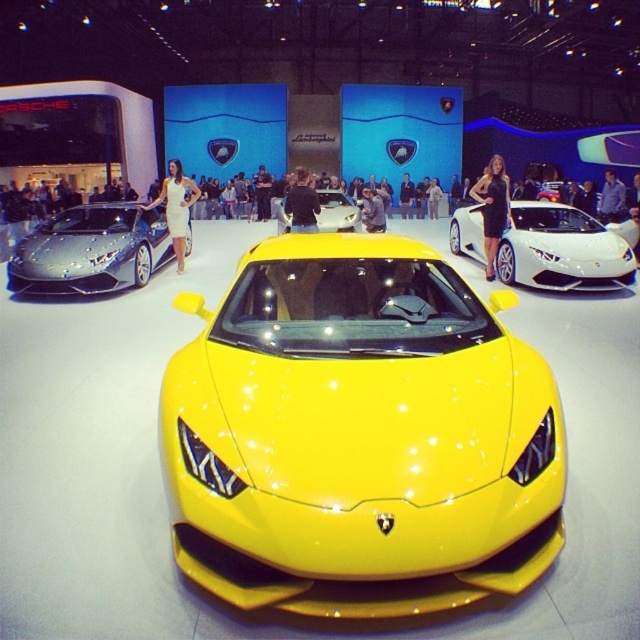
You are a fashion designer attending a luxury event and see two dresses displayed in the image. The black glossy dress at center and the white dress at left. Which dress is positioned closer to the right side of the image?

The black glossy dress at center is positioned to the right of the white dress at left, so it is closer to the right side of the image.